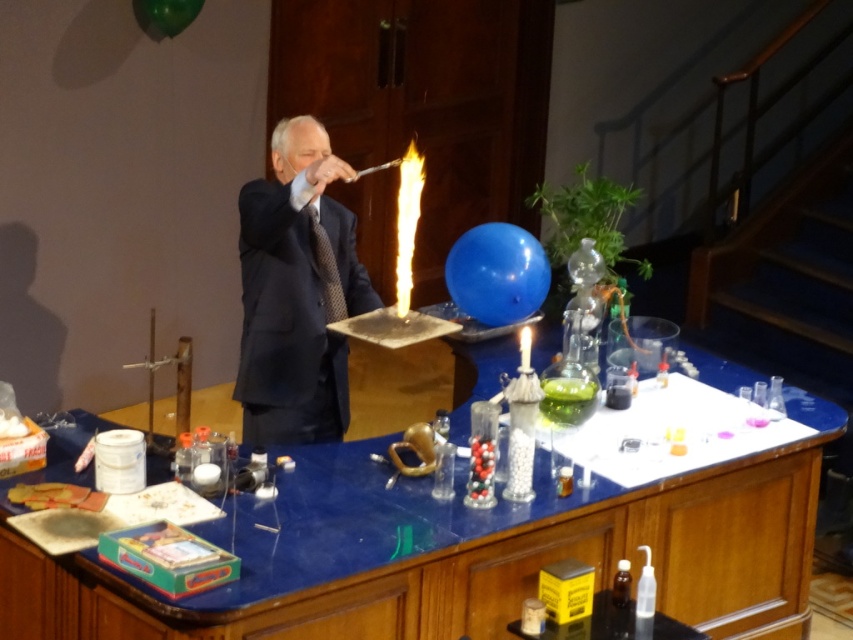
The width and height of the screenshot is (853, 640). I want to click on dark blue suit at center, so click(x=296, y=292).

Is dark blue suit at center bigger than green rubber balloon at upper center?

Yes, dark blue suit at center is bigger than green rubber balloon at upper center.

Is point (299, 116) closer to viewer compared to point (140, 3)?

Yes, point (299, 116) is in front of point (140, 3).

Where is `dark blue suit at center`? This screenshot has height=640, width=853. dark blue suit at center is located at coordinates pos(296,292).

Is black textured tie at center to the right of white wax candle at center from the viewer's perspective?

In fact, black textured tie at center is to the left of white wax candle at center.

Which of these two, black textured tie at center or white wax candle at center, stands taller?

black textured tie at center is taller.

This screenshot has width=853, height=640. Describe the element at coordinates (326, 268) in the screenshot. I see `black textured tie at center` at that location.

At what (x,y) coordinates should I click in order to perform the action: click on black textured tie at center. Please return your answer as a coordinate pair (x, y). Image resolution: width=853 pixels, height=640 pixels. Looking at the image, I should click on (326, 268).

Is matte blue balloon at center further to camera compared to white wax candle at center?

Yes.

Is matte blue balloon at center wider than white wax candle at center?

Yes, matte blue balloon at center is wider than white wax candle at center.

You are a GUI agent. You are given a task and a screenshot of the screen. Output one action in this format:
    pyautogui.click(x=<x>, y=<y>)
    Task: Click on the matte blue balloon at center
    The image size is (853, 640).
    Given the screenshot: What is the action you would take?
    pyautogui.click(x=497, y=273)